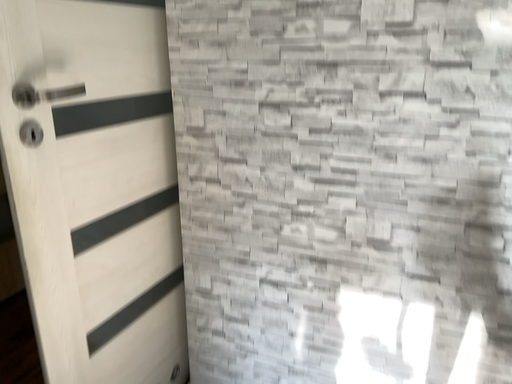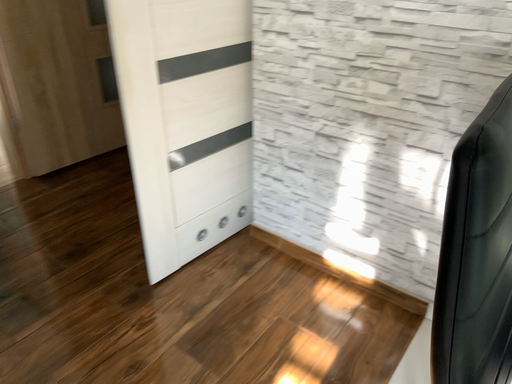
Question: Which way did the camera rotate in the video?

Choices:
 (A) rotated left
 (B) rotated right

Answer: (A)